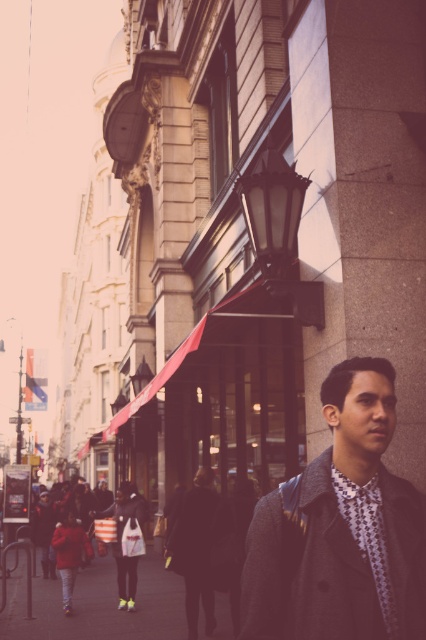
Question: Which of the following is the farthest from the observer?

Choices:
 (A) dark gray woolen jacket at lower right
 (B) dark gray wool coat at center
 (C) red wool coat at lower left

Answer: (C)

Question: Which object is positioned farthest from the red wool coat at lower left?

Choices:
 (A) smooth asphalt pavement at lower center
 (B) dark gray woolen jacket at lower right
 (C) dark gray wool coat at center

Answer: (B)

Question: Is smooth asphalt pavement at lower center bigger than dark gray wool coat at center?

Choices:
 (A) yes
 (B) no

Answer: (A)

Question: Does dark gray woolen jacket at lower right appear under dark gray wool coat at center?

Choices:
 (A) no
 (B) yes

Answer: (A)

Question: Among these objects, which one is nearest to the camera?

Choices:
 (A) dark gray wool coat at center
 (B) dark gray woolen jacket at lower right

Answer: (B)

Question: Is smooth asphalt pavement at lower center bigger than red wool coat at lower left?

Choices:
 (A) yes
 (B) no

Answer: (A)